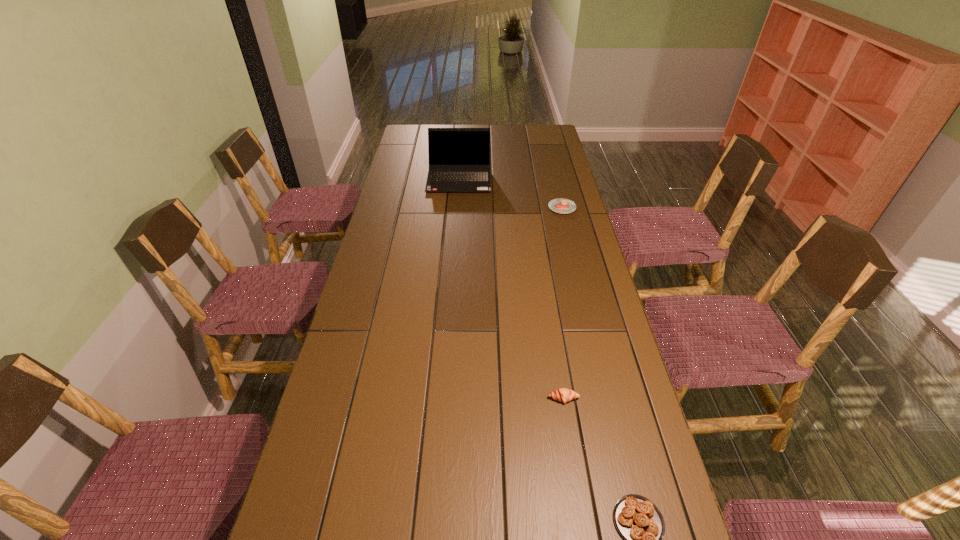
I want to click on vacant area that lies between the farthest object and the second object from left to right, so click(x=512, y=288).

Find the location of `vacant point located between the third farthest object and the laptop computer`. vacant point located between the third farthest object and the laptop computer is located at coordinates (512, 288).

Identify which object is the nearest to the tallest object. Please provide its 2D coordinates. Your answer should be formatted as a tuple, i.e. [(x, y)], where the tuple contains the x and y coordinates of a point satisfying the conditions above.

[(560, 205)]

You are a GUI agent. You are given a task and a screenshot of the screen. Output one action in this format:
    pyautogui.click(x=<x>, y=<y>)
    Task: Click on the object that is the second closest to the third nearest object
    
    Given the screenshot: What is the action you would take?
    pyautogui.click(x=563, y=395)

Identify which pastry is the closest to the leftmost pastry. Please provide its 2D coordinates. Your answer should be formatted as a tuple, i.e. [(x, y)], where the tuple contains the x and y coordinates of a point satisfying the conditions above.

[(639, 521)]

Where is `pastry that is the second closest to the nearest pastry`? The width and height of the screenshot is (960, 540). pastry that is the second closest to the nearest pastry is located at coordinates 560,205.

Find the location of `vacant space that satisfies the following two spatial constraints: 1. on the screen of the farthest object; 2. on the left side of the second farthest object`. vacant space that satisfies the following two spatial constraints: 1. on the screen of the farthest object; 2. on the left side of the second farthest object is located at coordinates (457, 207).